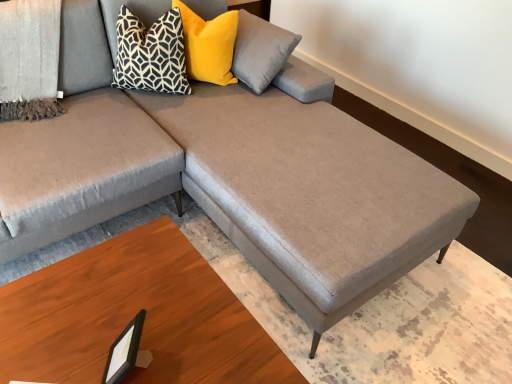
Question: Is black plastic picture frame at lower left aimed at yellow velvet pillow at upper center, acting as the first pillow starting from the right?

Choices:
 (A) yes
 (B) no

Answer: (B)

Question: Is black plastic picture frame at lower left to the left of yellow velvet pillow at upper center, acting as the 2th pillow starting from the left, from the viewer's perspective?

Choices:
 (A) yes
 (B) no

Answer: (A)

Question: Considering the relative positions of black plastic picture frame at lower left and yellow velvet pillow at upper center, acting as the first pillow starting from the right, in the image provided, is black plastic picture frame at lower left to the right of yellow velvet pillow at upper center, acting as the first pillow starting from the right, from the viewer's perspective?

Choices:
 (A) no
 (B) yes

Answer: (A)

Question: From a real-world perspective, does black plastic picture frame at lower left stand above yellow velvet pillow at upper center, acting as the 2th pillow starting from the left?

Choices:
 (A) yes
 (B) no

Answer: (B)

Question: Is there a large distance between black plastic picture frame at lower left and yellow velvet pillow at upper center, acting as the first pillow starting from the right?

Choices:
 (A) no
 (B) yes

Answer: (B)

Question: Considering the relative sizes of black plastic picture frame at lower left and yellow velvet pillow at upper center, acting as the 2th pillow starting from the left, in the image provided, is black plastic picture frame at lower left smaller than yellow velvet pillow at upper center, acting as the 2th pillow starting from the left,?

Choices:
 (A) no
 (B) yes

Answer: (B)

Question: Is the position of wooden table at lower right more distant than that of yellow velvet pillow at upper center, acting as the 2th pillow starting from the left?

Choices:
 (A) no
 (B) yes

Answer: (A)

Question: Could you tell me if wooden table at lower right is facing yellow velvet pillow at upper center, acting as the 2th pillow starting from the left?

Choices:
 (A) no
 (B) yes

Answer: (A)

Question: Is wooden table at lower right not near yellow velvet pillow at upper center, acting as the 2th pillow starting from the left?

Choices:
 (A) yes
 (B) no

Answer: (A)

Question: Considering the relative sizes of wooden table at lower right and yellow velvet pillow at upper center, acting as the 2th pillow starting from the left, in the image provided, is wooden table at lower right taller than yellow velvet pillow at upper center, acting as the 2th pillow starting from the left,?

Choices:
 (A) yes
 (B) no

Answer: (A)

Question: From the image's perspective, does wooden table at lower right appear higher than yellow velvet pillow at upper center, acting as the 2th pillow starting from the left?

Choices:
 (A) yes
 (B) no

Answer: (B)

Question: Would you say yellow velvet pillow at upper center, acting as the 2th pillow starting from the left, is part of wooden table at lower right's contents?

Choices:
 (A) no
 (B) yes

Answer: (A)

Question: Is wooden table at lower right at the right side of black plastic picture frame at lower left?

Choices:
 (A) yes
 (B) no

Answer: (B)